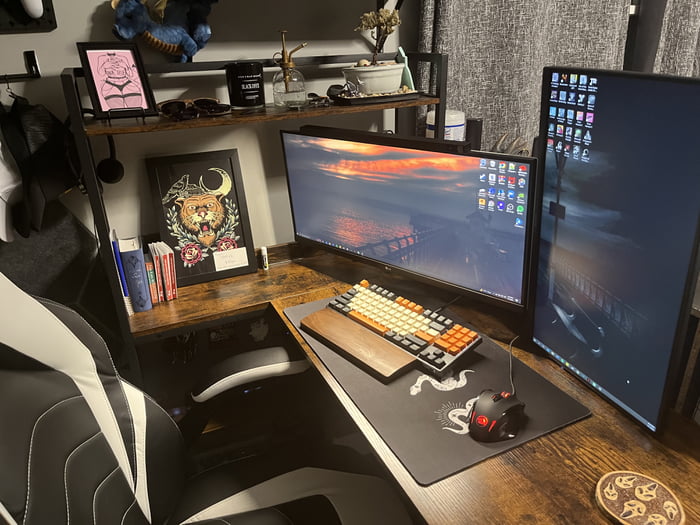
Locate an element on the screen. The image size is (700, 525). water sprayer for indoor plants is located at coordinates (295, 90).